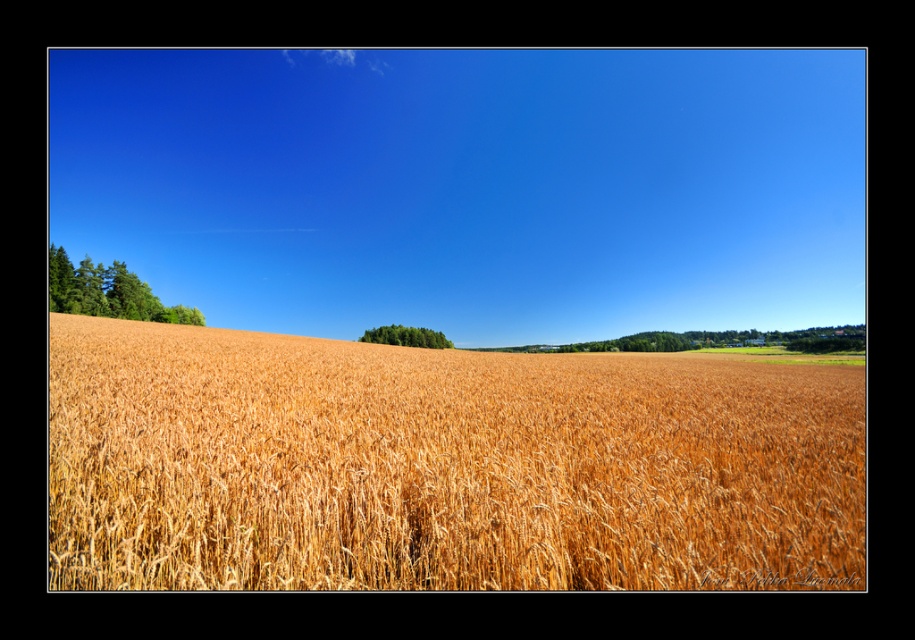
Is green textured trees at left positioned before green leafy trees at center?

Yes, green textured trees at left is closer to the viewer.

Does green textured trees at left have a greater width compared to green leafy trees at center?

Yes, green textured trees at left is wider than green leafy trees at center.

Between point (117, 308) and point (426, 330), which one is positioned behind?

Point (426, 330)

Identify the location of green textured trees at left. This screenshot has height=640, width=915. (108, 291).

Does golden wheat field at center appear over green leafy trees at center?

Indeed, golden wheat field at center is positioned over green leafy trees at center.

Image resolution: width=915 pixels, height=640 pixels. Find the location of `golden wheat field at center`. golden wheat field at center is located at coordinates (442, 467).

Consider the image. Who is positioned more to the left, golden wheat field at center or green textured trees at left?

green textured trees at left

Is point (467, 525) more distant than point (153, 316)?

No, (467, 525) is in front of (153, 316).

Which is in front, point (184, 474) or point (70, 292)?

Point (184, 474) is more forward.

What are the coordinates of `golden wheat field at center` in the screenshot? It's located at (442, 467).